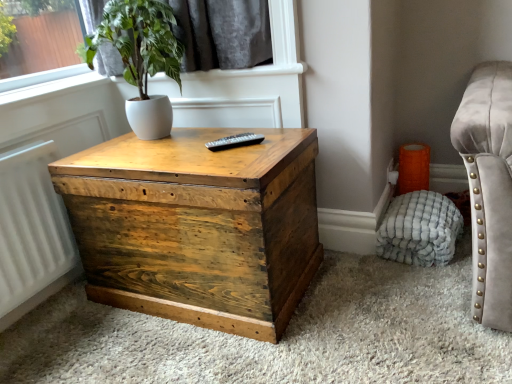
Question: Is white matte pot at upper left bigger than wooden trunk at center?

Choices:
 (A) yes
 (B) no

Answer: (B)

Question: Is white matte pot at upper left located outside wooden trunk at center?

Choices:
 (A) no
 (B) yes

Answer: (B)

Question: Is white matte pot at upper left positioned with its back to wooden trunk at center?

Choices:
 (A) no
 (B) yes

Answer: (A)

Question: Is white matte pot at upper left smaller than wooden trunk at center?

Choices:
 (A) no
 (B) yes

Answer: (B)

Question: Is white matte pot at upper left wider than wooden trunk at center?

Choices:
 (A) yes
 (B) no

Answer: (B)

Question: From the image's perspective, is white matte pot at upper left on top of wooden trunk at center?

Choices:
 (A) no
 (B) yes

Answer: (B)

Question: From a real-world perspective, does white textured pouf at lower right sit lower than black plastic remote at center?

Choices:
 (A) yes
 (B) no

Answer: (A)

Question: Can you see white textured pouf at lower right touching black plastic remote at center?

Choices:
 (A) yes
 (B) no

Answer: (B)

Question: Can you confirm if white textured pouf at lower right is wider than black plastic remote at center?

Choices:
 (A) yes
 (B) no

Answer: (A)

Question: Is black plastic remote at center at the back of white textured pouf at lower right?

Choices:
 (A) no
 (B) yes

Answer: (A)

Question: Is white textured pouf at lower right located outside black plastic remote at center?

Choices:
 (A) no
 (B) yes

Answer: (B)

Question: Considering the relative positions of white textured pouf at lower right and black plastic remote at center in the image provided, is white textured pouf at lower right behind black plastic remote at center?

Choices:
 (A) no
 (B) yes

Answer: (B)

Question: Is wooden trunk at center taller than white matte pot at upper left?

Choices:
 (A) no
 (B) yes

Answer: (B)